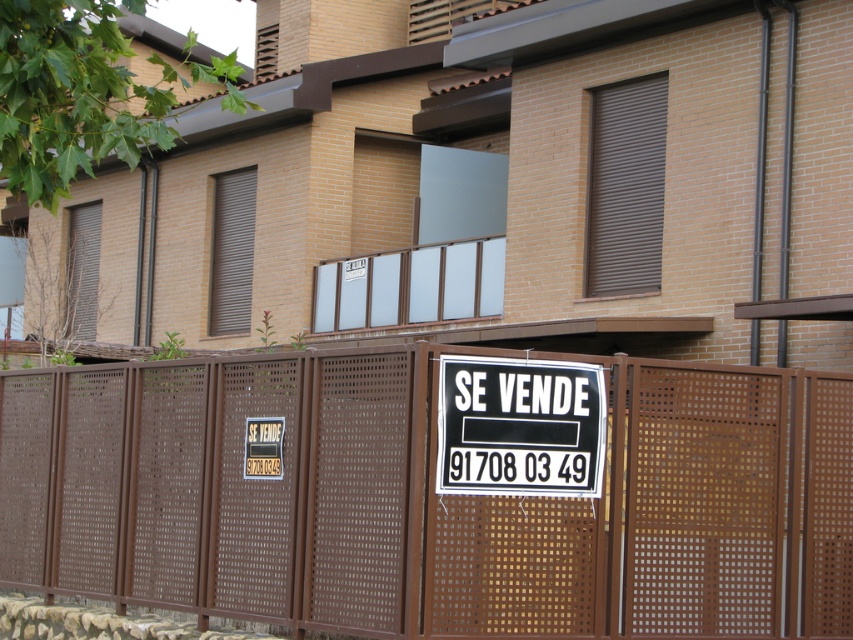
Question: Can you confirm if brown perforated fence at center is positioned to the left of black paper sign at center?

Choices:
 (A) no
 (B) yes

Answer: (B)

Question: Which point appears closest to the camera in this image?

Choices:
 (A) (444, 595)
 (B) (537, 448)

Answer: (A)

Question: Can you confirm if brown perforated fence at center is bigger than black paper sign at center?

Choices:
 (A) no
 (B) yes

Answer: (B)

Question: Which point appears farthest from the camera in this image?

Choices:
 (A) (123, 492)
 (B) (520, 480)

Answer: (A)

Question: Can you confirm if brown perforated fence at center is positioned below black paper sign at center?

Choices:
 (A) yes
 (B) no

Answer: (A)

Question: Which of the following is the farthest from the observer?

Choices:
 (A) brown perforated fence at center
 (B) black paper sign at center

Answer: (B)